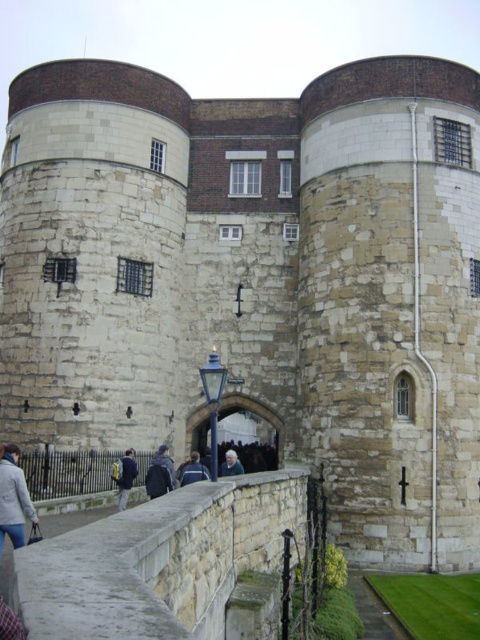
Is dark blue jacket at center bigger than gray hair at center?

Correct, dark blue jacket at center is larger in size than gray hair at center.

Can you confirm if dark blue jacket at center is shorter than gray hair at center?

In fact, dark blue jacket at center may be taller than gray hair at center.

Identify the location of dark blue jacket at center. (159, 474).

From the picture: Can you confirm if blue fabric jacket at center is positioned below gray hair at center?

No.

Who is more forward, (191, 461) or (239, 461)?

Point (191, 461) is in front.

At what (x,y) coordinates should I click in order to perform the action: click on blue fabric jacket at center. Please return your answer as a coordinate pair (x, y). Looking at the image, I should click on [192, 470].

Does blue denim jacket at lower center appear on the left side of gray hair at center?

Yes, blue denim jacket at lower center is to the left of gray hair at center.

Who is more distant from viewer, (x=133, y=468) or (x=222, y=465)?

Positioned behind is point (x=222, y=465).

Identify the location of blue denim jacket at lower center. (123, 476).